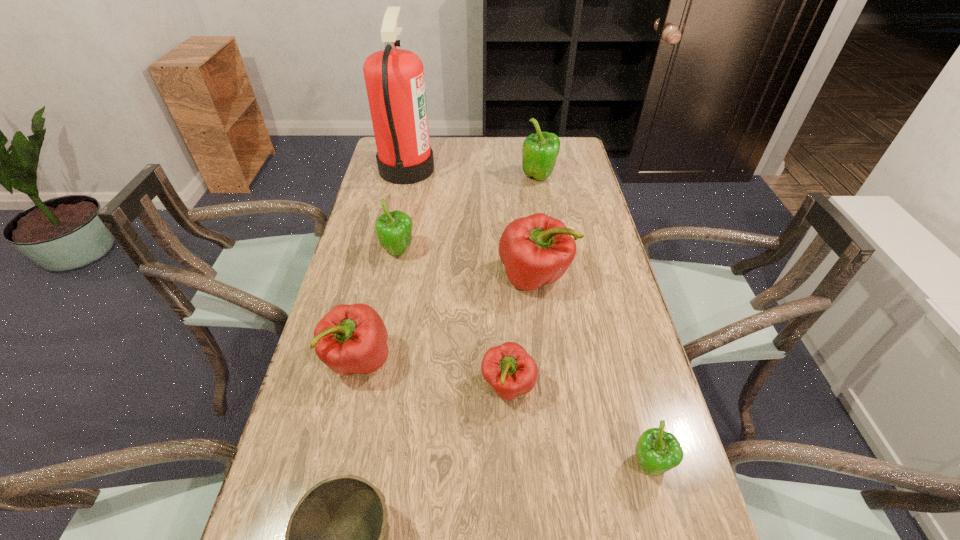
This screenshot has height=540, width=960. Find the location of `vacant space that satisfies the following two spatial constraints: 1. at the nozzle of the tallest object; 2. on the back side of the biggest pink bell pepper`. vacant space that satisfies the following two spatial constraints: 1. at the nozzle of the tallest object; 2. on the back side of the biggest pink bell pepper is located at coordinates (383, 277).